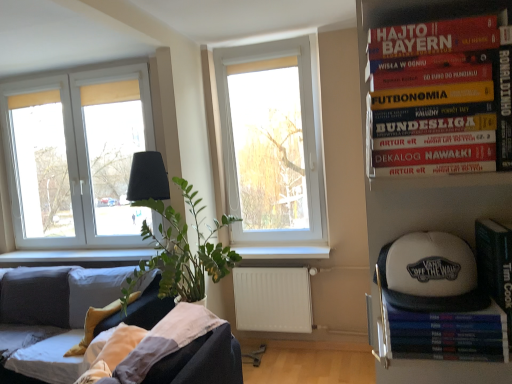
Question: Could white plastic window at left, which is the first window in left-to-right order, be considered to be inside hardcover book at upper right?

Choices:
 (A) no
 (B) yes

Answer: (A)

Question: Is hardcover book at upper right turned away from white plastic window at left, which is counted as the second window, starting from the right?

Choices:
 (A) no
 (B) yes

Answer: (A)

Question: Can you confirm if hardcover book at upper right is wider than white plastic window at left, the 2th window in the front-to-back sequence?

Choices:
 (A) no
 (B) yes

Answer: (B)

Question: From a real-world perspective, is hardcover book at upper right on top of white plastic window at left, which is counted as the second window, starting from the right?

Choices:
 (A) no
 (B) yes

Answer: (A)

Question: Does hardcover book at upper right have a greater height compared to white plastic window at left, which is counted as the second window, starting from the right?

Choices:
 (A) no
 (B) yes

Answer: (A)

Question: Considering the relative sizes of hardcover book at upper right and white plastic window at left, which is counted as the second window, starting from the right, in the image provided, is hardcover book at upper right thinner than white plastic window at left, which is counted as the second window, starting from the right,?

Choices:
 (A) yes
 (B) no

Answer: (B)

Question: Is white fabric baseball cap at right located outside hardcover book at upper right?

Choices:
 (A) no
 (B) yes

Answer: (B)

Question: Does white fabric baseball cap at right have a greater width compared to hardcover book at upper right?

Choices:
 (A) no
 (B) yes

Answer: (B)

Question: Does white fabric baseball cap at right have a larger size compared to hardcover book at upper right?

Choices:
 (A) no
 (B) yes

Answer: (A)

Question: Is white fabric baseball cap at right surrounding hardcover book at upper right?

Choices:
 (A) yes
 (B) no

Answer: (B)

Question: Are white fabric baseball cap at right and hardcover book at upper right beside each other?

Choices:
 (A) no
 (B) yes

Answer: (A)

Question: From a real-world perspective, is white fabric baseball cap at right under hardcover book at upper right?

Choices:
 (A) no
 (B) yes

Answer: (B)

Question: From the image's perspective, is velvet dark grey couch at lower left on white matte radiator at lower center?

Choices:
 (A) no
 (B) yes

Answer: (A)